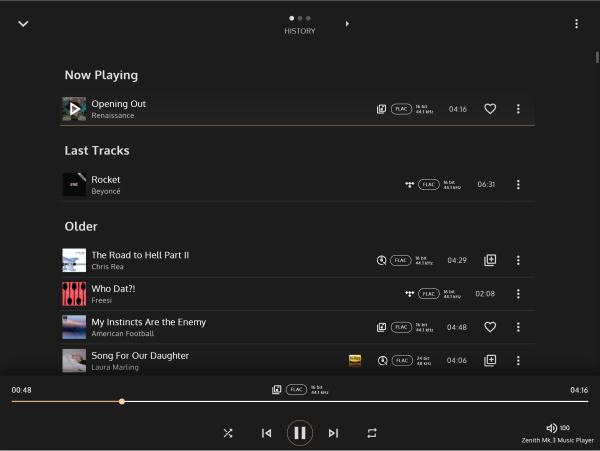
Where is `music control buttons`? Image resolution: width=600 pixels, height=451 pixels. music control buttons is located at coordinates (226, 433), (266, 435), (301, 433), (330, 433), (373, 433), (72, 107).